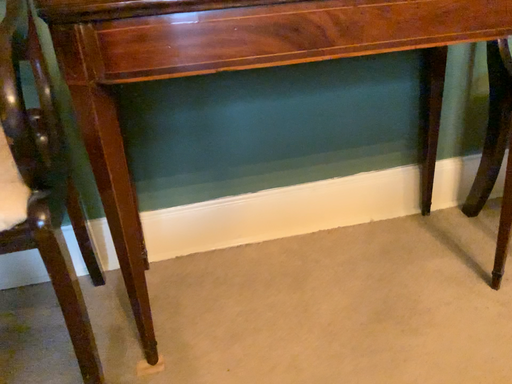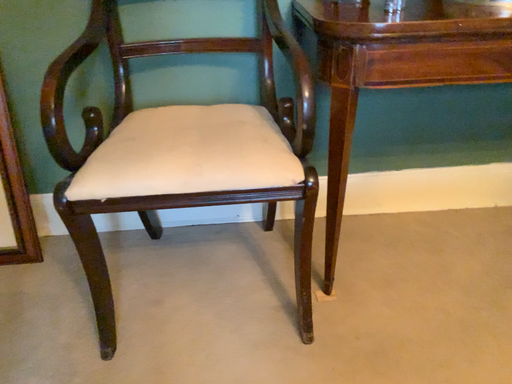
Question: Which way did the camera rotate in the video?

Choices:
 (A) rotated right
 (B) rotated left

Answer: (B)